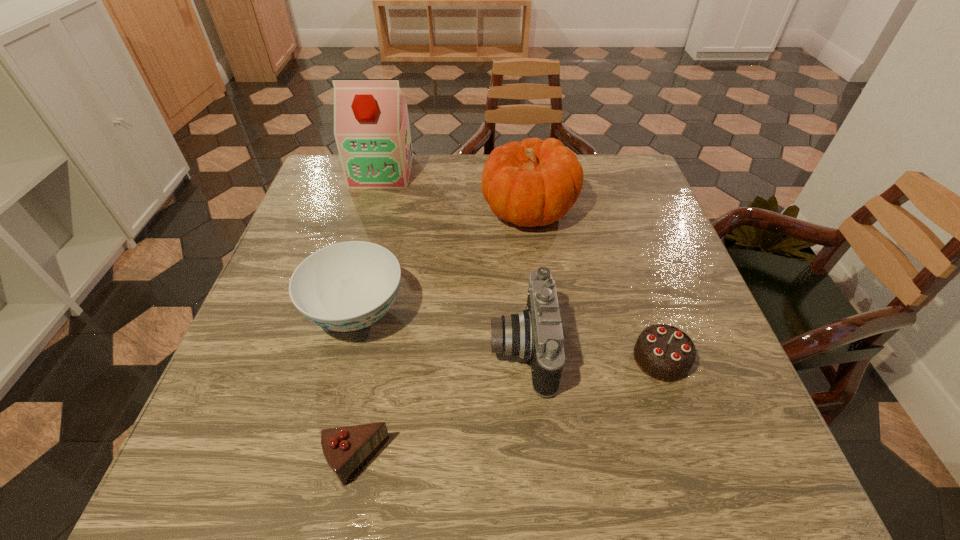
The height and width of the screenshot is (540, 960). What are the coordinates of `soya milk` in the screenshot? It's located at (371, 126).

This screenshot has width=960, height=540. What are the coordinates of `pumpkin` in the screenshot? It's located at (533, 183).

Find the location of a particular element. The width and height of the screenshot is (960, 540). camera is located at coordinates (536, 333).

Locate an element on the screen. Image resolution: width=960 pixels, height=540 pixels. the third shortest object is located at coordinates (347, 286).

This screenshot has width=960, height=540. Find the location of `the rightmost object`. the rightmost object is located at coordinates (663, 352).

Find the location of a particular element. the right chocolate cake is located at coordinates click(x=663, y=352).

Locate an element on the screen. The image size is (960, 540). the left chocolate cake is located at coordinates (346, 449).

Image resolution: width=960 pixels, height=540 pixels. Find the location of `the nearest object`. the nearest object is located at coordinates (346, 449).

The image size is (960, 540). What are the coordinates of `vacant area situated with the cap open on the soya milk` in the screenshot? It's located at (366, 230).

Where is `free location located 0.250m on the left of the fifth shortest object`? free location located 0.250m on the left of the fifth shortest object is located at coordinates [387, 210].